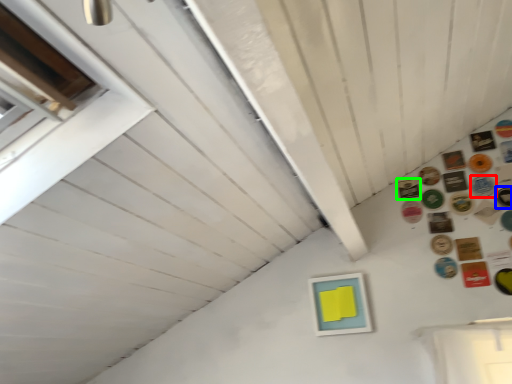
Question: Which is nearer to the button (highlighted by a red box)? button (highlighted by a blue box) or button (highlighted by a green box).

Choices:
 (A) button
 (B) button

Answer: (A)